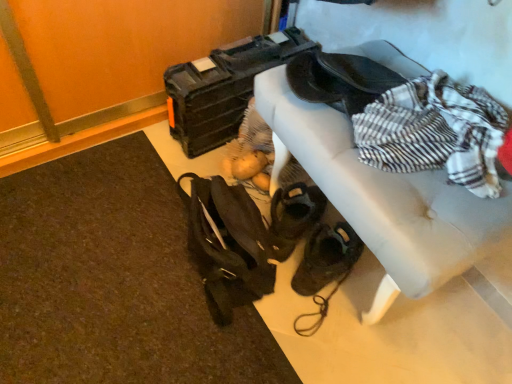
Question: Is matte black toolbox at upper center a part of leather couch at upper right?

Choices:
 (A) no
 (B) yes

Answer: (A)

Question: Does leather couch at upper right have a lesser height compared to matte black toolbox at upper center?

Choices:
 (A) no
 (B) yes

Answer: (A)

Question: Can we say leather couch at upper right lies outside matte black toolbox at upper center?

Choices:
 (A) no
 (B) yes

Answer: (B)

Question: Does leather couch at upper right have a greater width compared to matte black toolbox at upper center?

Choices:
 (A) yes
 (B) no

Answer: (B)

Question: Does leather couch at upper right turn towards matte black toolbox at upper center?

Choices:
 (A) no
 (B) yes

Answer: (A)

Question: Is point (205, 203) positioned closer to the camera than point (209, 137)?

Choices:
 (A) farther
 (B) closer

Answer: (B)

Question: From the image's perspective, relative to matte black toolbox at upper center, is dark brown leather messenger bag at lower center above or below?

Choices:
 (A) above
 (B) below

Answer: (B)

Question: In the image, is dark brown leather messenger bag at lower center positioned in front of or behind matte black toolbox at upper center?

Choices:
 (A) behind
 (B) front

Answer: (B)

Question: From a real-world perspective, is dark brown leather messenger bag at lower center above or below matte black toolbox at upper center?

Choices:
 (A) above
 (B) below

Answer: (B)

Question: From a real-world perspective, is matte black toolbox at upper center physically located above or below leather couch at upper right?

Choices:
 (A) above
 (B) below

Answer: (B)

Question: Considering their positions, is matte black toolbox at upper center located in front of or behind leather couch at upper right?

Choices:
 (A) front
 (B) behind

Answer: (B)

Question: Considering the positions of matte black toolbox at upper center and leather couch at upper right in the image, is matte black toolbox at upper center wider or thinner than leather couch at upper right?

Choices:
 (A) wide
 (B) thin

Answer: (A)

Question: From the image's perspective, relative to leather couch at upper right, is matte black toolbox at upper center above or below?

Choices:
 (A) below
 (B) above

Answer: (B)

Question: From a real-world perspective, is leather couch at upper right positioned above or below matte black toolbox at upper center?

Choices:
 (A) below
 (B) above

Answer: (B)

Question: Is point 502,246 closer or farther from the camera than point 239,117?

Choices:
 (A) farther
 (B) closer

Answer: (B)